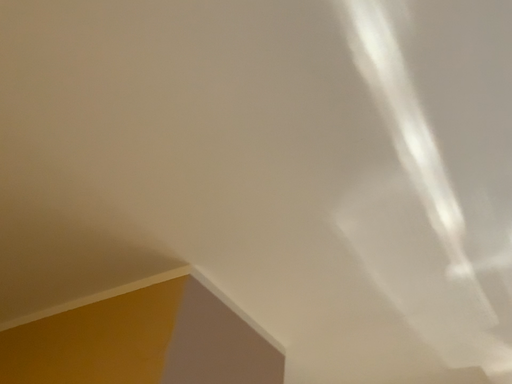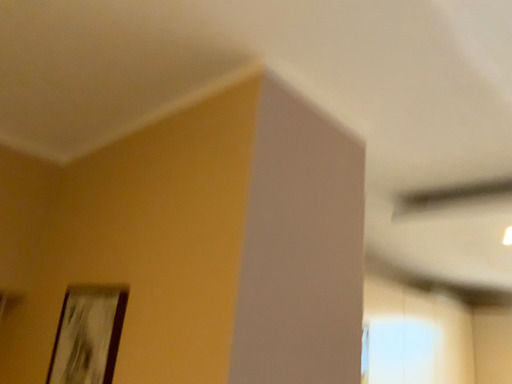
Question: How did the camera likely rotate when shooting the video?

Choices:
 (A) rotated left
 (B) rotated right

Answer: (A)